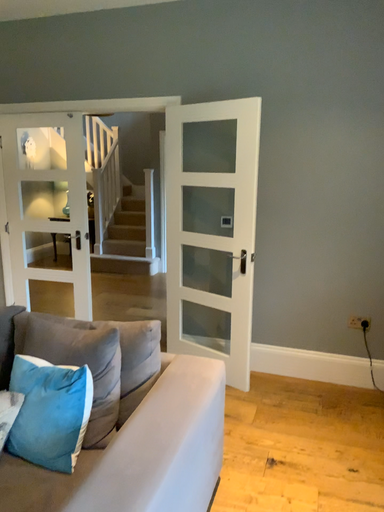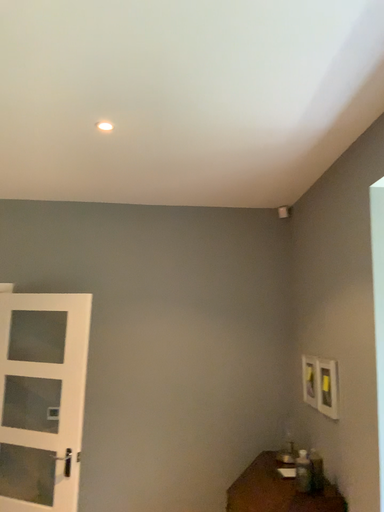
Question: How did the camera likely rotate when shooting the video?

Choices:
 (A) rotated right
 (B) rotated left

Answer: (A)